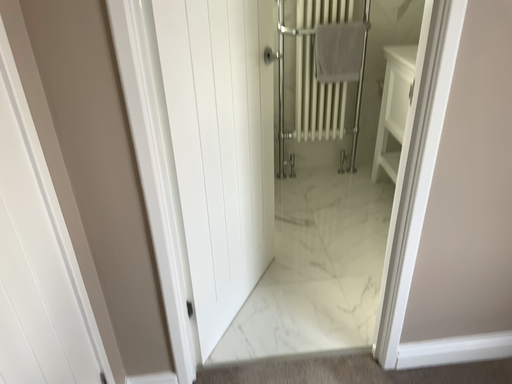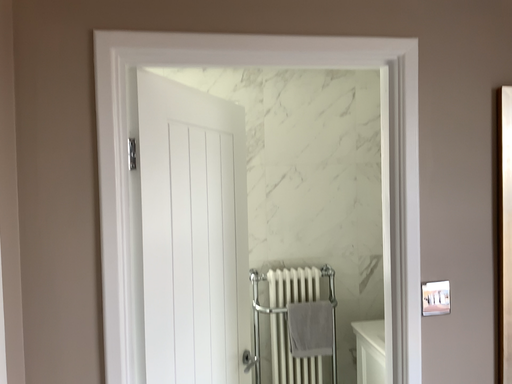
Question: Which way did the camera rotate in the video?

Choices:
 (A) rotated downward
 (B) rotated upward

Answer: (B)